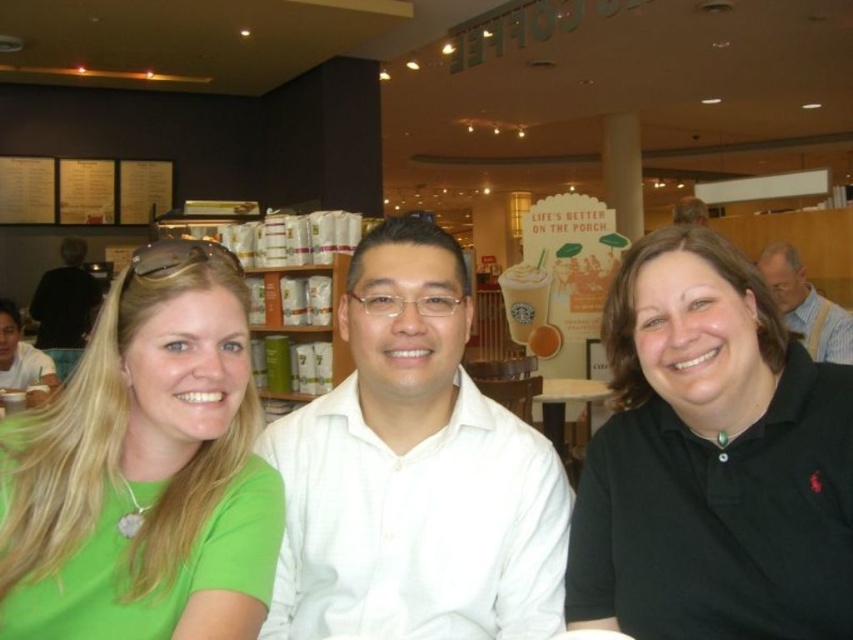
Can you confirm if black shirt at left is shorter than white shirt at center?

No, black shirt at left is not shorter than white shirt at center.

Can you confirm if black shirt at left is thinner than white shirt at center?

No, black shirt at left is not thinner than white shirt at center.

This screenshot has height=640, width=853. What are the coordinates of `black shirt at left` in the screenshot? It's located at point(65,305).

Which is more to the left, white smooth shirt at center or matte white shirt at center?

white smooth shirt at center is more to the left.

Does white smooth shirt at center appear under matte white shirt at center?

Indeed, white smooth shirt at center is positioned under matte white shirt at center.

Is point (328, 609) less distant than point (685, 196)?

Yes, it is in front of point (685, 196).

Locate an element on the screen. This screenshot has height=640, width=853. white smooth shirt at center is located at coordinates (415, 472).

Who is higher up, green matte shirt at left or matte white shirt at center?

Positioned higher is matte white shirt at center.

How distant is green matte shirt at left from matte white shirt at center?

The distance of green matte shirt at left from matte white shirt at center is 4.08 meters.

Describe the element at coordinates (141, 467) in the screenshot. The width and height of the screenshot is (853, 640). I see `green matte shirt at left` at that location.

This screenshot has height=640, width=853. Identify the location of green matte shirt at left. (141, 467).